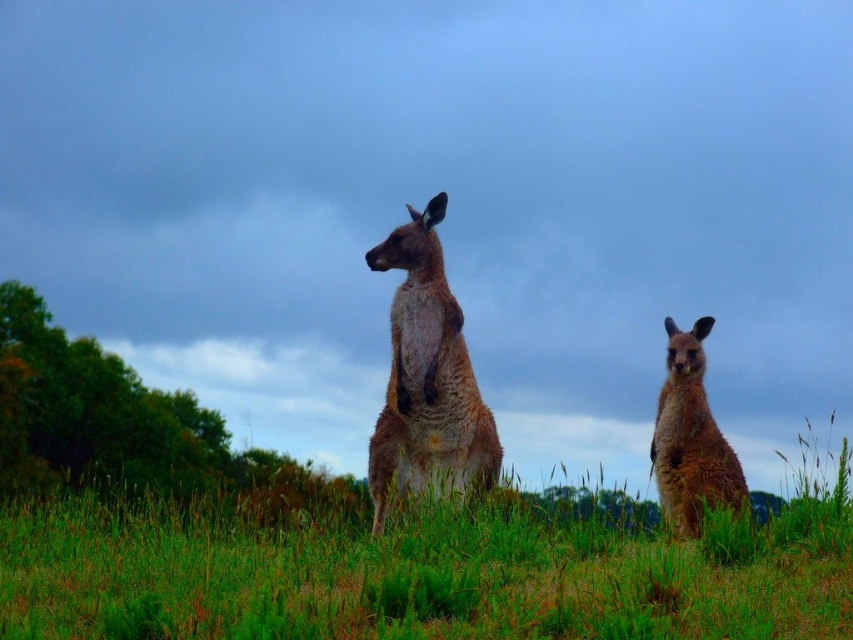
Question: Which object is the farthest from the brown furry kangaroo at right?

Choices:
 (A) green grassy at center
 (B) furry brown kangaroo at center

Answer: (A)

Question: In this image, where is green grassy at center located relative to furry brown kangaroo at center?

Choices:
 (A) below
 (B) above

Answer: (A)

Question: Does green grassy at center have a lesser width compared to brown furry kangaroo at right?

Choices:
 (A) no
 (B) yes

Answer: (A)

Question: Can you confirm if green grassy at center is positioned above furry brown kangaroo at center?

Choices:
 (A) no
 (B) yes

Answer: (A)

Question: Which object is closer to the camera taking this photo?

Choices:
 (A) green grassy at center
 (B) furry brown kangaroo at center

Answer: (A)

Question: Which point is closer to the camera taking this photo?

Choices:
 (A) (422, 268)
 (B) (675, 448)

Answer: (A)